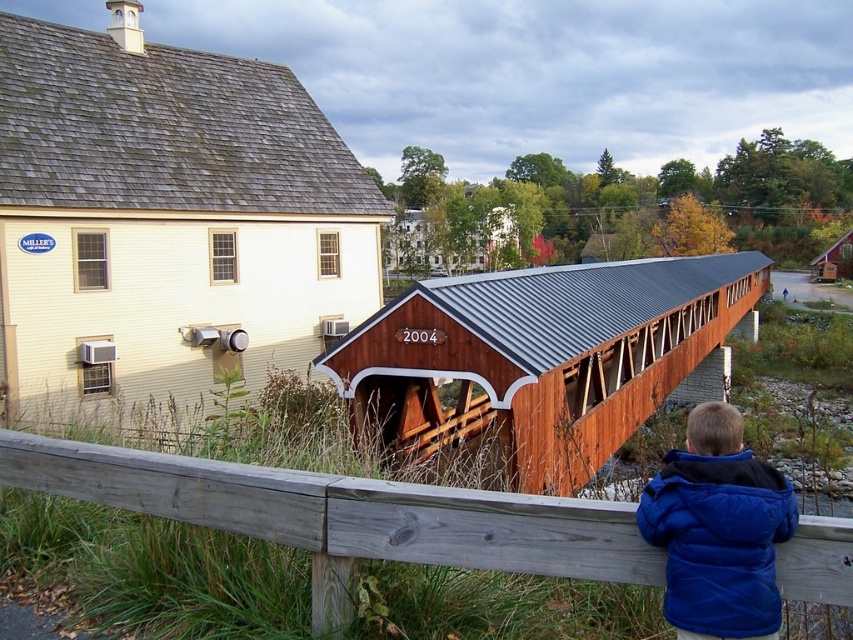
You are standing in front of the gray wood fence at lower center and want to take a photo of the entire scene. Considering the distance between you and the fence, will you be able to capture both the fence and the bridge in the frame?

The gray wood fence at lower center is 9.62 feet away from the camera. Since the fence is relatively close to the camera, you can step back slightly to include both the fence and the bridge in the frame.

You are a delivery person with a cart that is 2 meters wide. You need to deliver packages to the gray wood fence at lower center from the wooden bridge at center. Can your cart pass through the space between them?

The wooden bridge at center and gray wood fence at lower center are 18.95 meters apart, so yes, the cart can pass through the space between them since the distance is much wider than the cart.